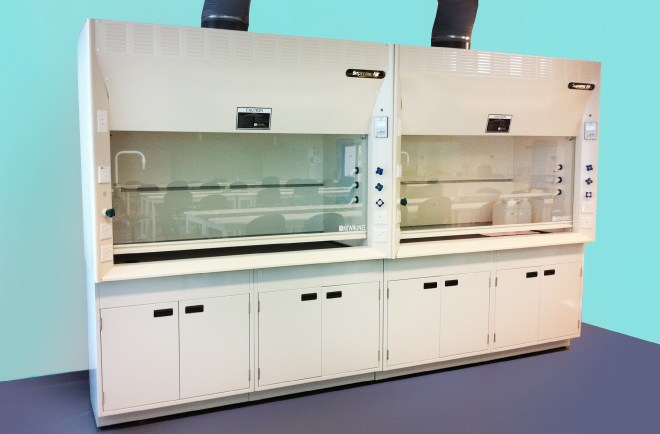
Where is `cupboard`? cupboard is located at coordinates (167, 362).